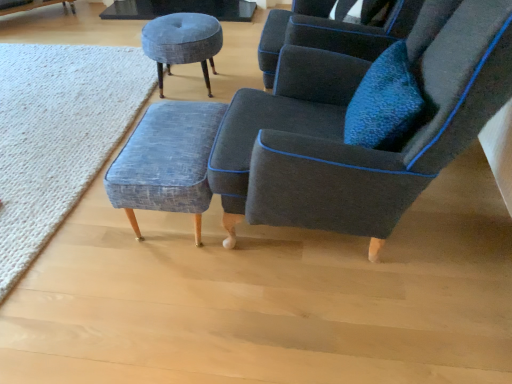
Find the location of a particular element. vacant space situated on the left part of textured blue fabric stool at center, which is counted as the 2th stool, starting from the back is located at coordinates (88, 236).